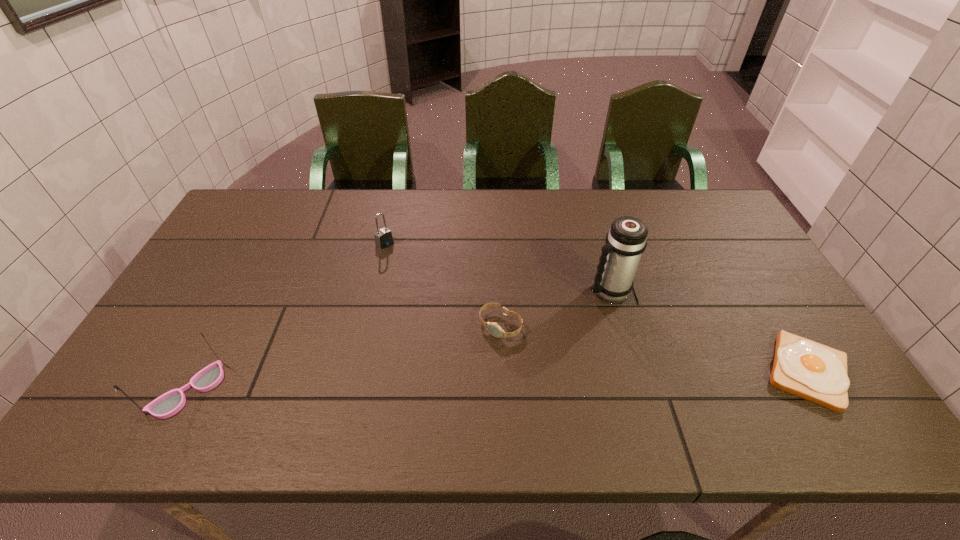
The image size is (960, 540). What are the coordinates of `vacant space located on the back of the spectacles` in the screenshot? It's located at (252, 271).

The width and height of the screenshot is (960, 540). In order to click on vacant space located on the left of the toast in this screenshot , I will do `click(640, 371)`.

Image resolution: width=960 pixels, height=540 pixels. In order to click on free space located on the shackle of the padlock in this screenshot , I will do `click(433, 281)`.

Image resolution: width=960 pixels, height=540 pixels. I want to click on free space located on the shackle of the padlock, so click(421, 273).

The image size is (960, 540). What are the coordinates of `vacant space located 0.380m on the shackle of the padlock` in the screenshot? It's located at (472, 313).

The height and width of the screenshot is (540, 960). Find the location of `vacant space located 0.260m on the side with the handle of the thermos bottle`. vacant space located 0.260m on the side with the handle of the thermos bottle is located at coordinates (526, 346).

Identify the location of free space located 0.140m on the side with the handle of the thermos bottle. (559, 323).

Where is `free space located 0.320m on the side with the handle of the thermos bottle`? The height and width of the screenshot is (540, 960). free space located 0.320m on the side with the handle of the thermos bottle is located at coordinates coord(508,358).

I want to click on vacant region located 0.110m on the face of the watch, so click(x=464, y=368).

This screenshot has width=960, height=540. In order to click on free spot located 0.070m on the face of the watch in this screenshot , I will do `click(473, 357)`.